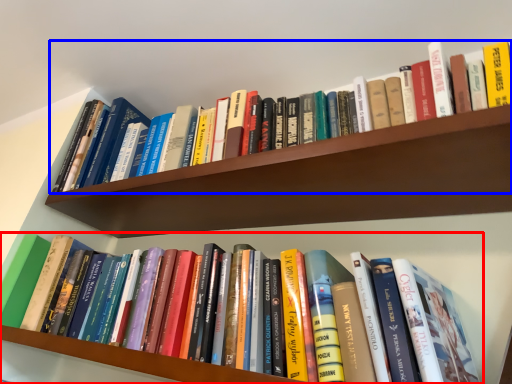
Question: Which object appears farthest to the camera in this image, book (highlighted by a red box) or book (highlighted by a blue box)?

Choices:
 (A) book
 (B) book

Answer: (B)